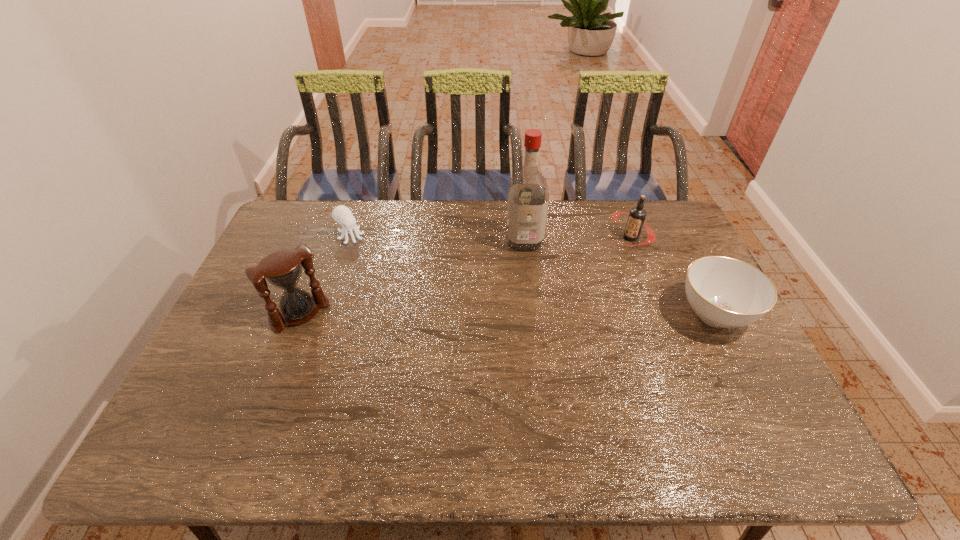
Where is `the second tallest object`? The height and width of the screenshot is (540, 960). the second tallest object is located at coordinates (283, 269).

Locate an element on the screen. chinaware is located at coordinates (724, 292).

Locate an element on the screen. The image size is (960, 540). the third shortest object is located at coordinates (637, 215).

Find the location of a particular element. Image resolution: width=960 pixels, height=540 pixels. the third object from left to right is located at coordinates (528, 196).

Where is `liquor`? This screenshot has height=540, width=960. liquor is located at coordinates pyautogui.click(x=528, y=196).

Where is `octopus`? octopus is located at coordinates (341, 214).

Find the location of `vacant space situated on the right of the second tallest object`. vacant space situated on the right of the second tallest object is located at coordinates (460, 313).

The width and height of the screenshot is (960, 540). Identify the location of vacant space located 0.130m on the front of the chinaware. (752, 388).

You are a GUI agent. You are given a task and a screenshot of the screen. Output one action in this format:
    pyautogui.click(x=<x>, y=<y>)
    Task: Click on the vacant region located on the label of the root beer
    The height and width of the screenshot is (540, 960).
    Given the screenshot: What is the action you would take?
    pyautogui.click(x=579, y=271)

Where is `free space located 0.080m on the label of the root beer`? free space located 0.080m on the label of the root beer is located at coordinates (600, 255).